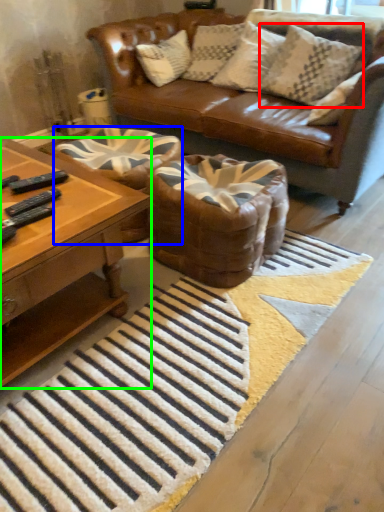
Question: Which is farther away from pillow (highlighted by a red box)? swivel chair (highlighted by a blue box) or coffee table (highlighted by a green box)?

Choices:
 (A) swivel chair
 (B) coffee table

Answer: (B)